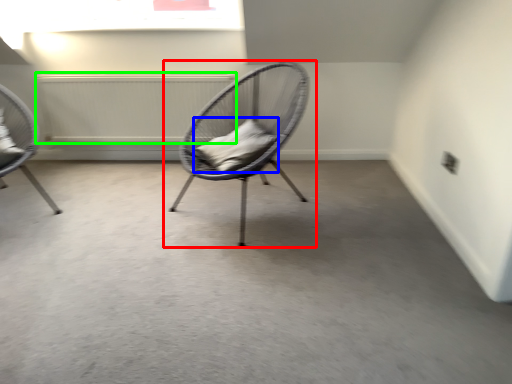
Question: Which object is the farthest from chair (highlighted by a red box)? Choose among these: pillow (highlighted by a blue box) or radiator (highlighted by a green box).

Choices:
 (A) pillow
 (B) radiator

Answer: (B)